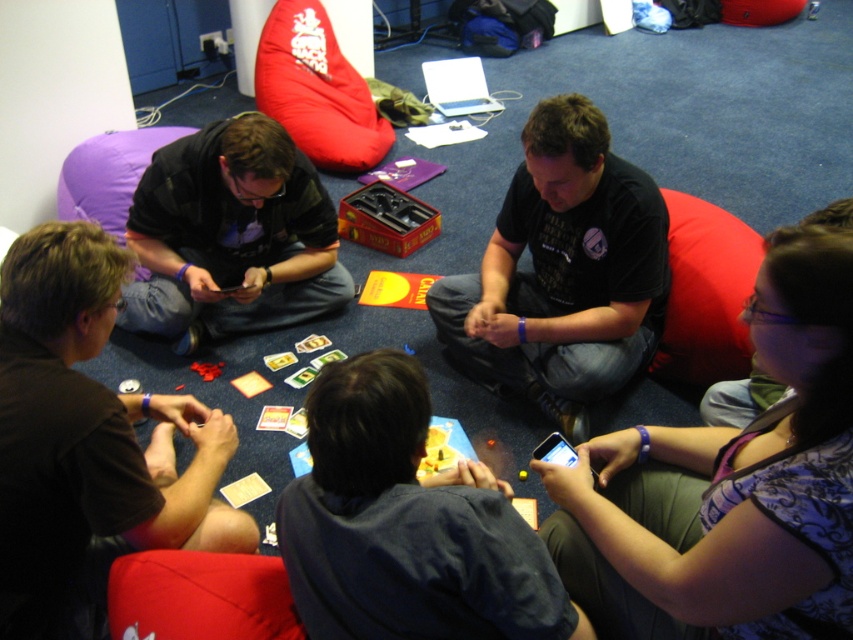
Question: Among these objects, which one is nearest to the camera?

Choices:
 (A) purple fabric at lower right
 (B) black matte shirt at center

Answer: (A)

Question: Is purple fabric at lower right smaller than brown matte shirt at lower left?

Choices:
 (A) yes
 (B) no

Answer: (A)

Question: Which point is farther from the camera taking this photo?

Choices:
 (A) (349, 150)
 (B) (36, 481)

Answer: (A)

Question: Does brown matte shirt at lower left come behind dark blue shirt at center?

Choices:
 (A) yes
 (B) no

Answer: (A)

Question: Which point is farther to the camera?

Choices:
 (A) brown matte shirt at lower left
 (B) matte black shirt at left
 (C) purple fabric at lower right

Answer: (B)

Question: In this image, where is brown matte shirt at lower left located relative to dark blue shirt at center?

Choices:
 (A) right
 (B) left

Answer: (B)